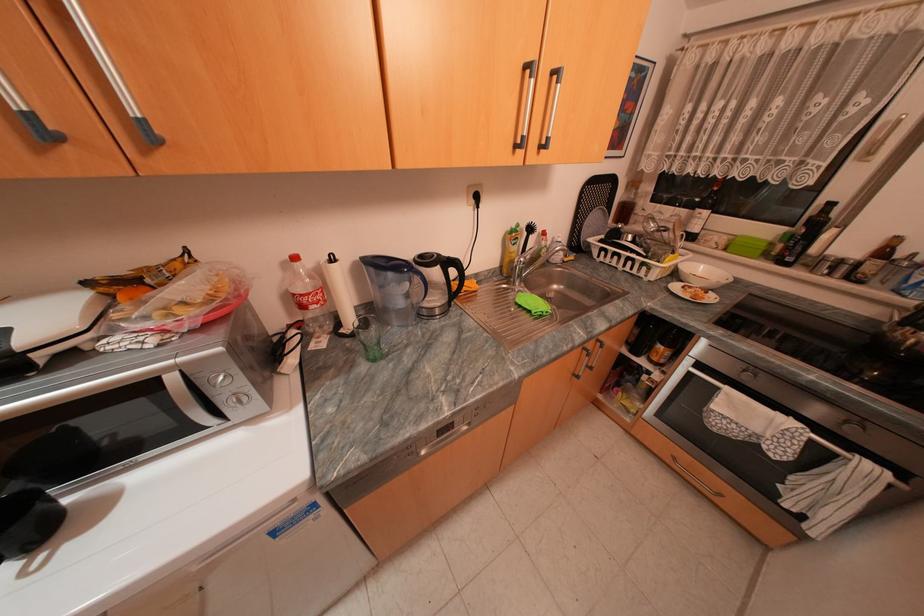
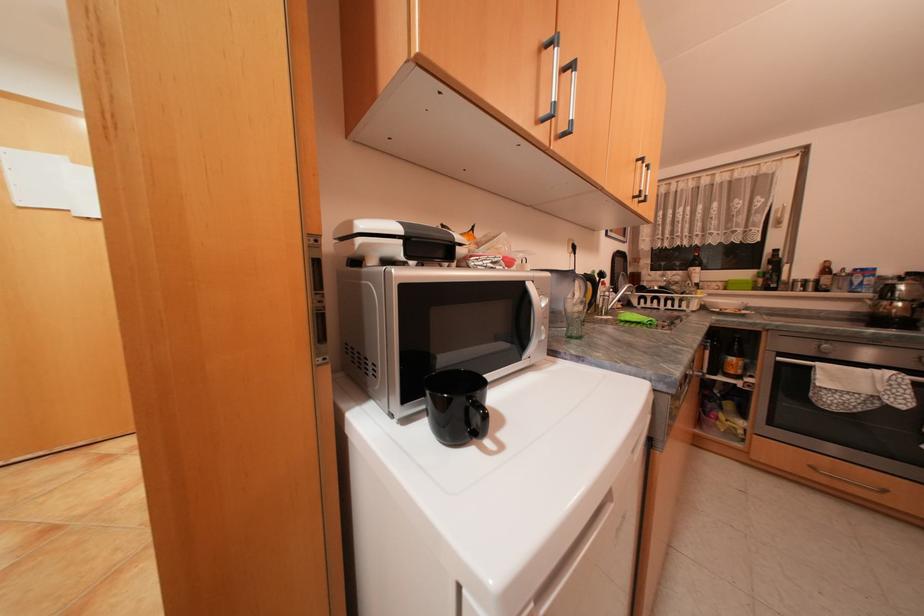
Question: The images are taken continuously from a first-person perspective. In which direction is your viewpoint rotating?

Choices:
 (A) Left
 (B) Right
 (C) Up
 (D) Down

Answer: (C)